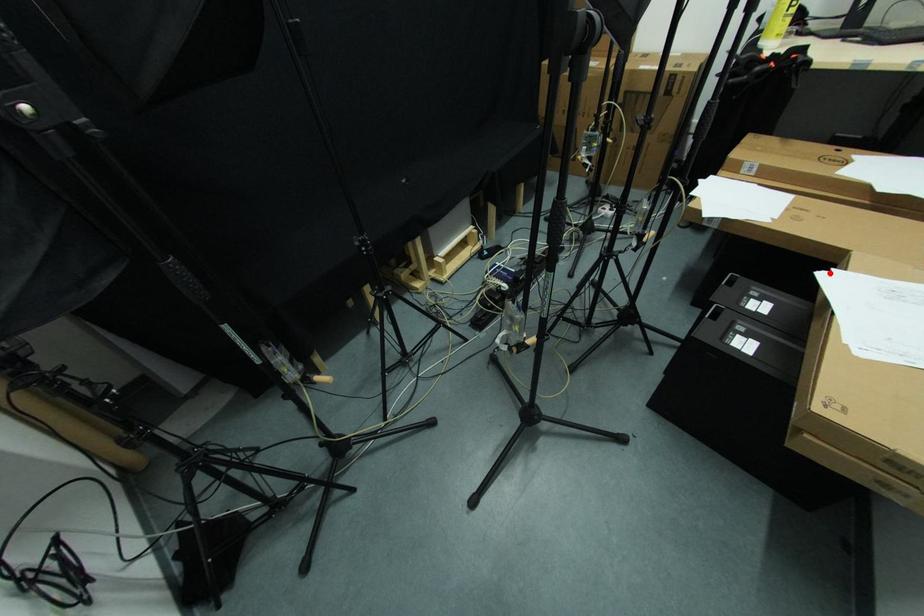
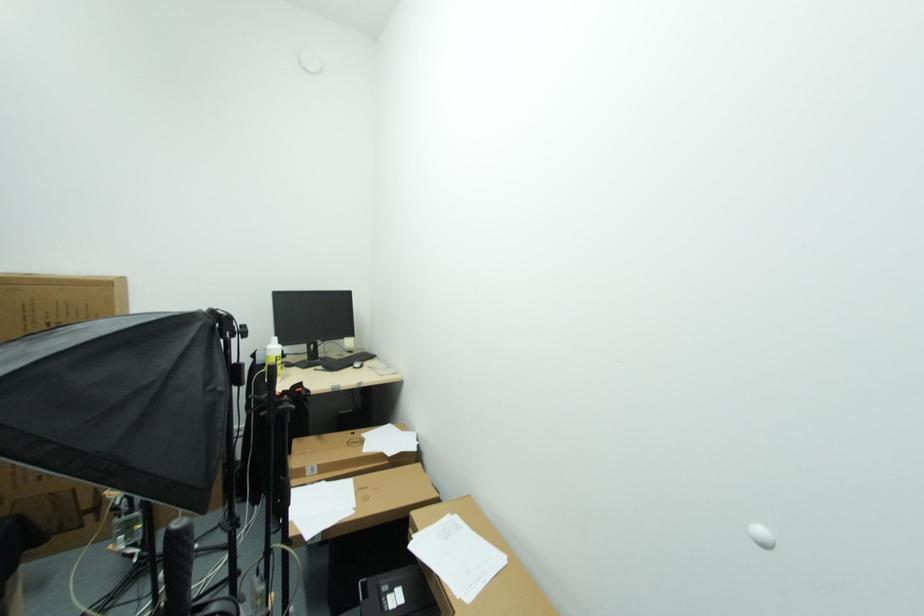
Question: I am providing you with two images of the same scene from different viewpoints. A red point is marked on the first image. Can you still see the location of the red point in image 2?

Choices:
 (A) Yes
 (B) No

Answer: (A)